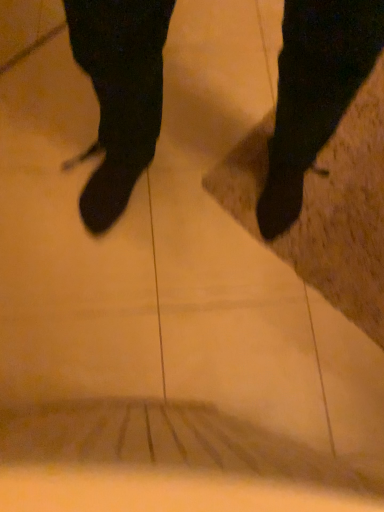
Where is `free location to the left of black leather shoe at right`? The width and height of the screenshot is (384, 512). free location to the left of black leather shoe at right is located at coordinates (213, 86).